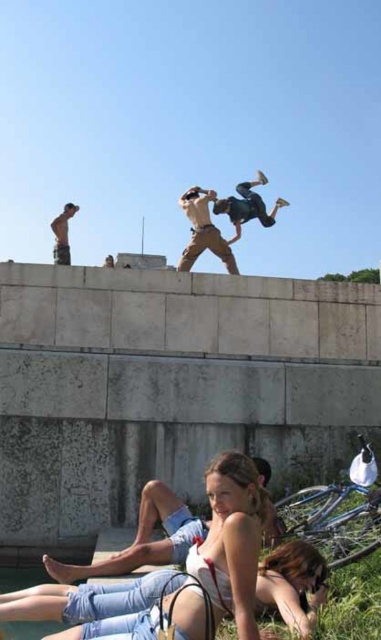
You are standing in the scene and see the denim shorts at lower center and the matte khaki pants at center. Which one is located to the left?

The denim shorts at lower center is positioned on the left side of matte khaki pants at center, so the denim shorts at lower center is located to the left.

You are standing in the scene and want to place a small flag at the point that is closer to you. Which point should you choose between point (x=310, y=563) and point (x=65, y=241)?

You should choose point (x=310, y=563) because it is closer to the viewer than point (x=65, y=241).

You are standing at the origin point of the coordinate system. You want to walk to the denim shorts at lower center. What are the coordinates you need to move to?

The coordinates to move to are 0.912 in the x direction and 0.769 in the y direction.